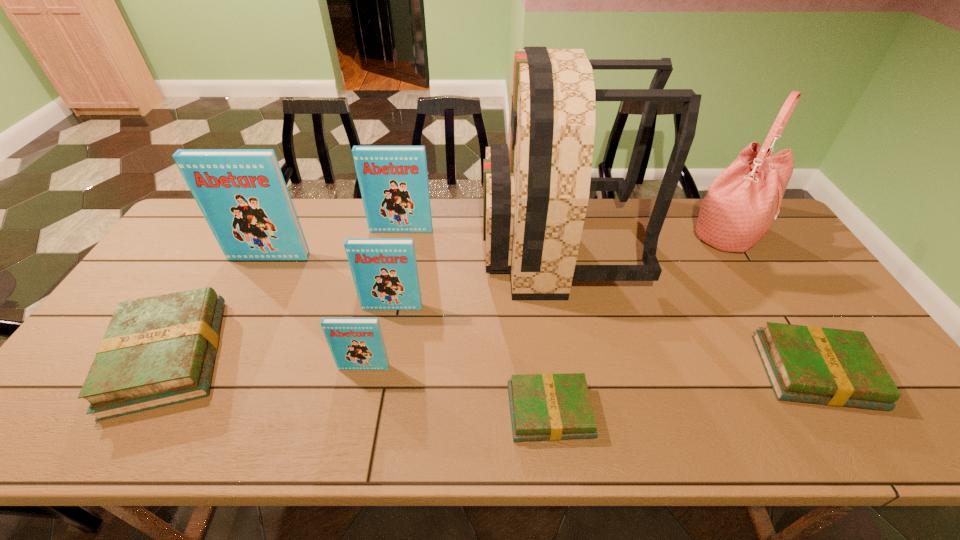
In order to click on vacant region located 0.060m on the front cover of the third nearest blue book in this screenshot , I will do `click(260, 274)`.

Locate an element on the screen. The image size is (960, 540). vacant region located 0.310m on the front cover of the second tallest book is located at coordinates (387, 303).

Find the location of `vacant space located on the front cover of the third tallest book`. vacant space located on the front cover of the third tallest book is located at coordinates (373, 407).

The width and height of the screenshot is (960, 540). In order to click on vacant position located on the front cover of the fourth tallest book in this screenshot , I will do `click(354, 412)`.

What are the coordinates of `vacant space located on the right of the seventh tallest object` in the screenshot? It's located at (266, 356).

What are the coordinates of `free space located on the left of the rightmost book` in the screenshot? It's located at (663, 372).

In order to click on free space located on the left of the second yellow book from left to right in this screenshot , I will do `click(412, 411)`.

I want to click on backpack that is at the far edge, so click(536, 188).

Locate an element on the screen. handbag at the far edge is located at coordinates (742, 202).

This screenshot has height=540, width=960. What are the coordinates of `book located at the far edge` in the screenshot? It's located at (393, 180).